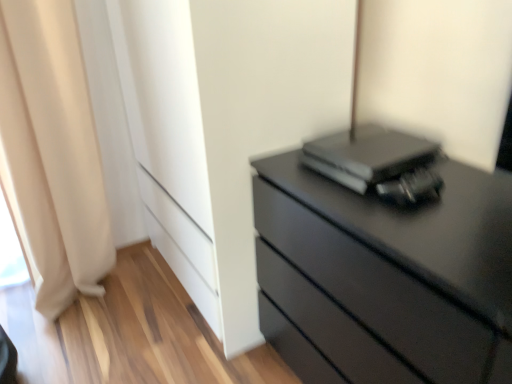
You are a GUI agent. You are given a task and a screenshot of the screen. Output one action in this format:
    pyautogui.click(x=<x>, y=<y>)
    Task: Click on the vacant region to the left of black matte computer at upper right
    Image resolution: width=512 pixels, height=384 pixels.
    Given the screenshot: What is the action you would take?
    pyautogui.click(x=300, y=170)